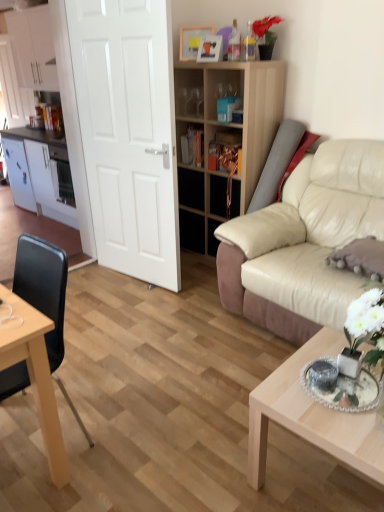
Question: Considering the relative positions of white glossy cabinets at left, the 1th cabinetry from the bottom, and black leather chair at left in the image provided, is white glossy cabinets at left, the 1th cabinetry from the bottom, to the left of black leather chair at left from the viewer's perspective?

Choices:
 (A) no
 (B) yes

Answer: (B)

Question: Would you say black leather chair at left is part of white glossy cabinets at left, which appears as the 3th cabinetry when viewed from the top,'s contents?

Choices:
 (A) yes
 (B) no

Answer: (B)

Question: Can you confirm if white glossy cabinets at left, which appears as the 3th cabinetry when viewed from the top, is thinner than black leather chair at left?

Choices:
 (A) no
 (B) yes

Answer: (A)

Question: Is white glossy cabinets at left, the 1th cabinetry from the bottom, taller than black leather chair at left?

Choices:
 (A) yes
 (B) no

Answer: (A)

Question: From the image's perspective, does white glossy cabinets at left, which appears as the 3th cabinetry when viewed from the top, appear higher than black leather chair at left?

Choices:
 (A) no
 (B) yes

Answer: (B)

Question: Is white glossy cabinets at left, which appears as the 3th cabinetry when viewed from the top, bigger than black leather chair at left?

Choices:
 (A) no
 (B) yes

Answer: (B)

Question: Are beige leather couch at right and white matte door at center beside each other?

Choices:
 (A) no
 (B) yes

Answer: (A)

Question: Does beige leather couch at right have a lesser width compared to white matte door at center?

Choices:
 (A) no
 (B) yes

Answer: (A)

Question: Is beige leather couch at right to the right of white matte door at center from the viewer's perspective?

Choices:
 (A) no
 (B) yes

Answer: (B)

Question: From a real-world perspective, is beige leather couch at right positioned under white matte door at center based on gravity?

Choices:
 (A) yes
 (B) no

Answer: (A)

Question: Is beige leather couch at right positioned with its back to white matte door at center?

Choices:
 (A) yes
 (B) no

Answer: (B)

Question: Could you tell me if beige leather couch at right is facing white matte door at center?

Choices:
 (A) no
 (B) yes

Answer: (A)

Question: Does white matte door at center have a greater width compared to wooden shelf at center?

Choices:
 (A) yes
 (B) no

Answer: (B)